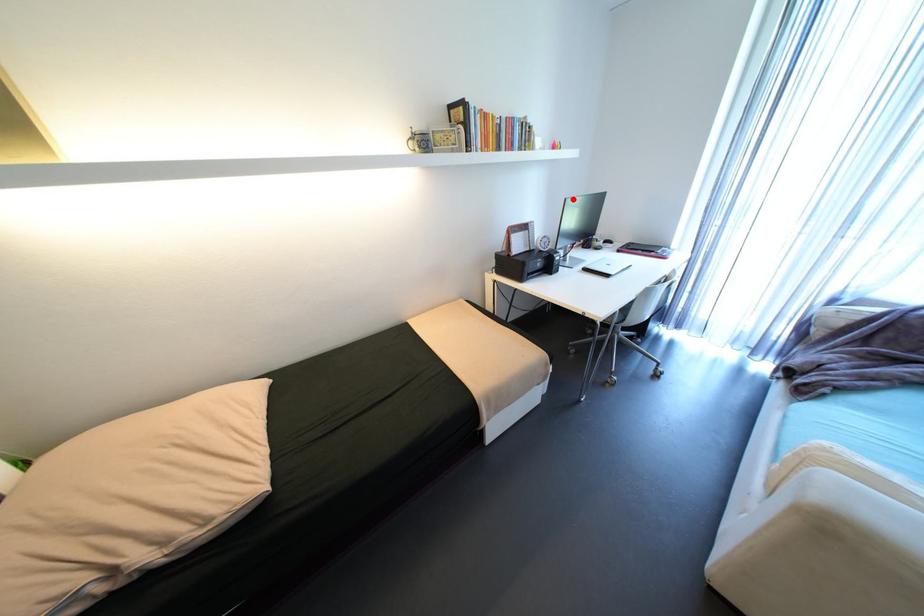
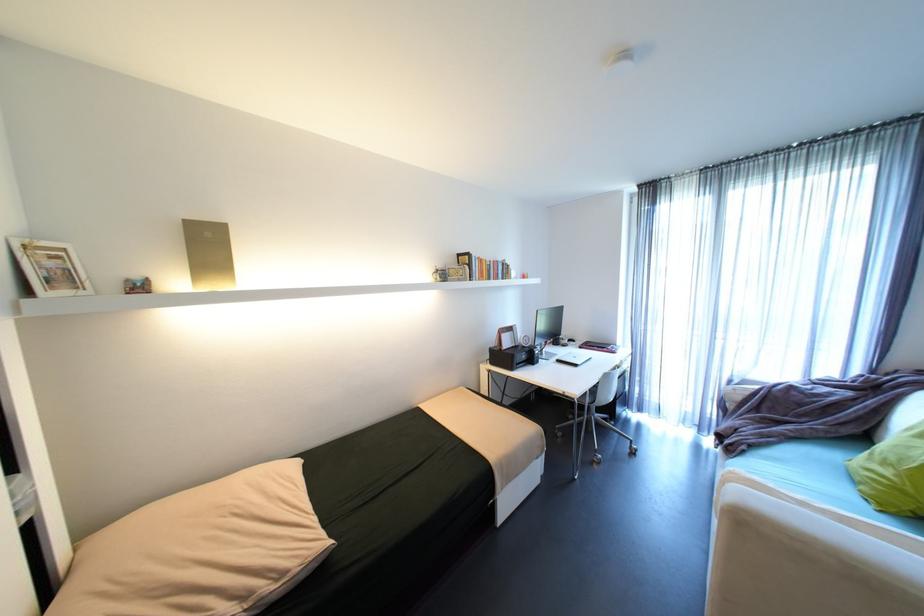
Where in the second image is the point corresponding to the highlighted location from the first image?

(544, 310)